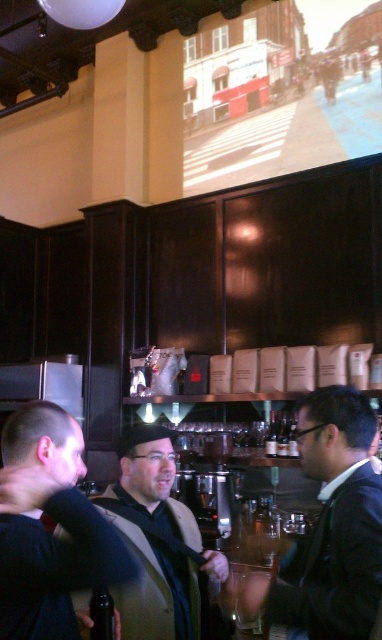
Question: Which object is closer to the camera taking this photo?

Choices:
 (A) dark gray suit at center
 (B) dark blue sweater at center

Answer: (B)

Question: Can you confirm if dark brown leather jacket at center is positioned below dark gray suit at center?

Choices:
 (A) no
 (B) yes

Answer: (A)

Question: Which object appears farthest from the camera in this image?

Choices:
 (A) dark blue sweater at center
 (B) dark gray suit at center

Answer: (B)

Question: Does dark brown leather jacket at center appear on the left side of dark gray suit at center?

Choices:
 (A) yes
 (B) no

Answer: (B)

Question: Is dark brown leather jacket at center positioned in front of dark gray suit at center?

Choices:
 (A) no
 (B) yes

Answer: (B)

Question: Which point is closer to the camera taking this photo?

Choices:
 (A) (148, 465)
 (B) (341, 529)
 (C) (64, 420)

Answer: (C)